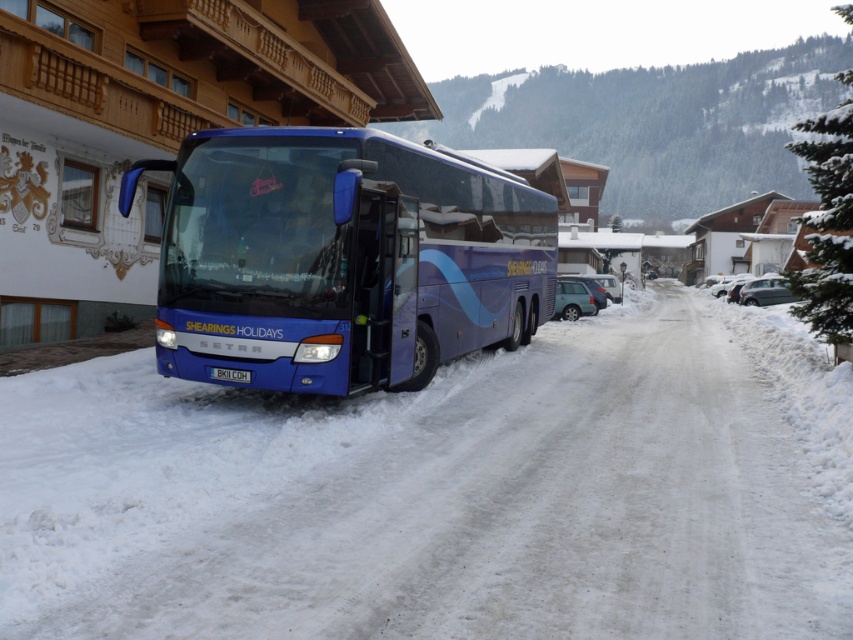
Question: Which point is closer to the camera?

Choices:
 (A) blue metallic bus at center
 (B) white powdery snow at center

Answer: (B)

Question: Does white powdery snow at center have a smaller size compared to blue metallic bus at center?

Choices:
 (A) no
 (B) yes

Answer: (B)

Question: Which object appears closest to the camera in this image?

Choices:
 (A) blue metallic bus at center
 (B) white powdery snow at center

Answer: (B)

Question: Does white powdery snow at center appear under blue metallic bus at center?

Choices:
 (A) yes
 (B) no

Answer: (A)

Question: Is white powdery snow at center smaller than blue metallic bus at center?

Choices:
 (A) yes
 (B) no

Answer: (A)